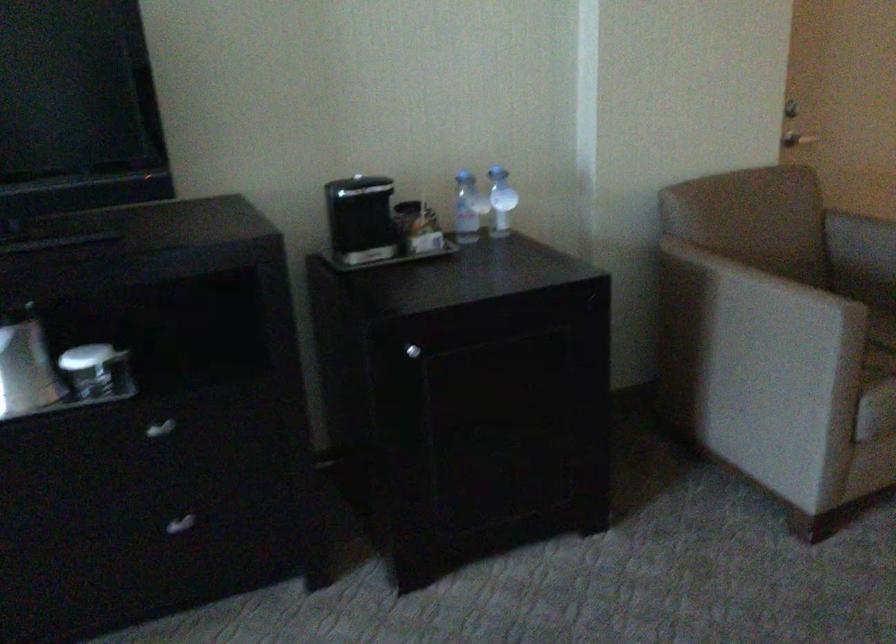
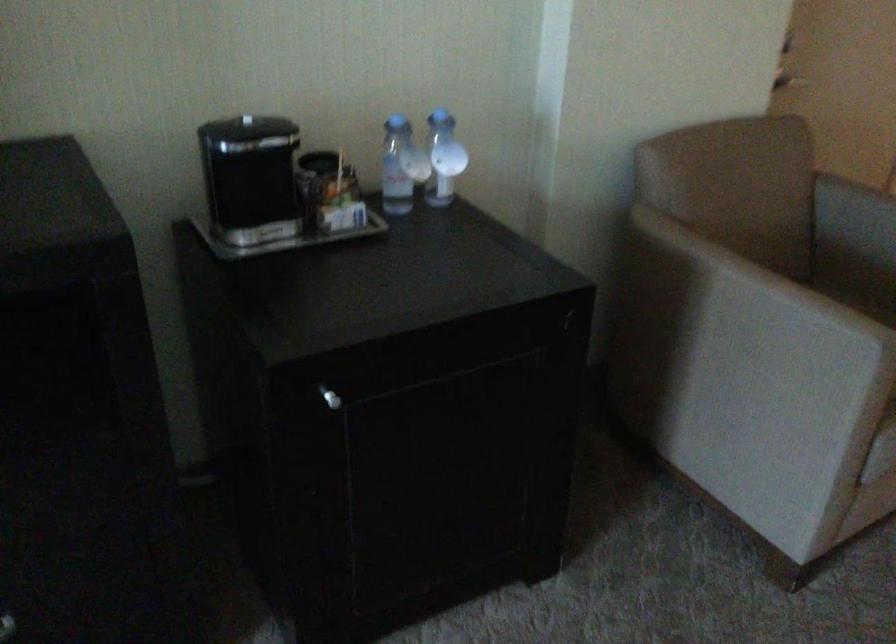
The point at (x=355, y=174) is marked in the first image. Where is the corresponding point in the second image?

(246, 120)